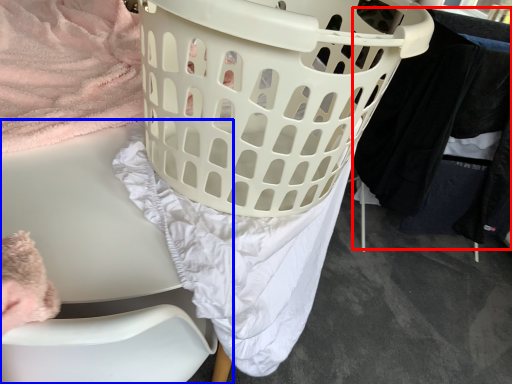
Question: Which object is closer to the camera taking this photo, clothing (highlighted by a red box) or furniture (highlighted by a blue box)?

Choices:
 (A) clothing
 (B) furniture

Answer: (B)